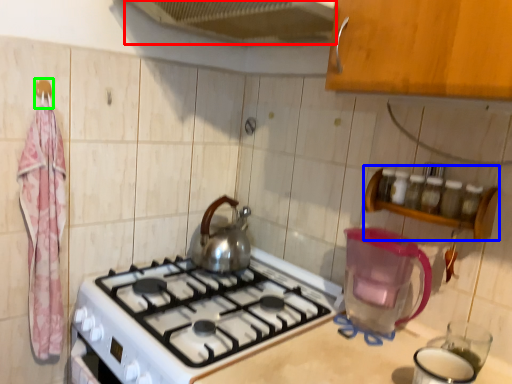
Question: Considering the real-world distances, which object is farthest from exhaust hood (highlighted by a red box)? shelf (highlighted by a blue box) or hanger (highlighted by a green box)?

Choices:
 (A) shelf
 (B) hanger

Answer: (A)